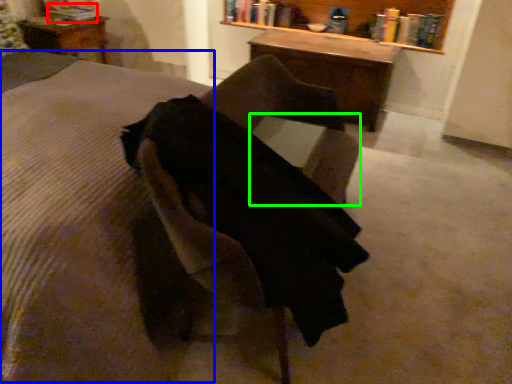
Question: Estimate the real-world distances between objects in this image. Which object is closer to book (highlighted by a red box), mattress (highlighted by a blue box) or table (highlighted by a green box)?

Choices:
 (A) mattress
 (B) table

Answer: (A)